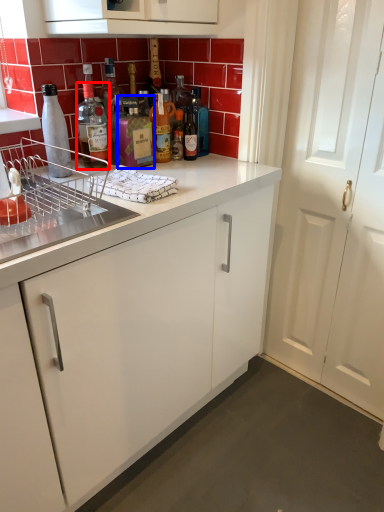
Question: Among these objects, which one is nearest to the camera, bottle (highlighted by a red box) or bottle (highlighted by a blue box)?

Choices:
 (A) bottle
 (B) bottle

Answer: (B)